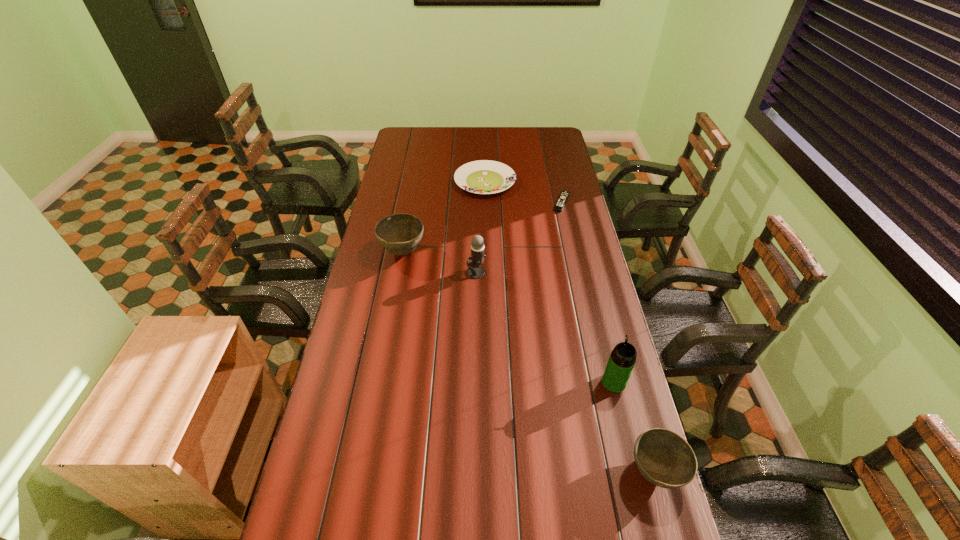
The height and width of the screenshot is (540, 960). Find the location of `free space located on the front of the salad plate`. free space located on the front of the salad plate is located at coordinates (486, 208).

Where is `vacant region located 0.170m on the front of the shortest object`? The height and width of the screenshot is (540, 960). vacant region located 0.170m on the front of the shortest object is located at coordinates (569, 238).

This screenshot has height=540, width=960. Identify the location of blank space located from the spout of the fifth farthest object. (604, 341).

The width and height of the screenshot is (960, 540). What are the coordinates of `free space located from the spout of the fifth farthest object` in the screenshot? It's located at (594, 302).

Find the location of a particular element. free space located from the spout of the fifth farthest object is located at coordinates (608, 356).

Locate an element on the screen. Image resolution: width=960 pixels, height=540 pixels. vacant space located on the front of the microphone is located at coordinates (475, 325).

You are a GUI agent. You are given a task and a screenshot of the screen. Output one action in this format:
    pyautogui.click(x=<x>, y=<y>)
    Task: Click on the object that is positioned at the near edge
    
    Given the screenshot: What is the action you would take?
    pyautogui.click(x=665, y=459)

The width and height of the screenshot is (960, 540). I want to click on object that is positioned at the left edge, so click(x=399, y=234).

The width and height of the screenshot is (960, 540). Identify the location of bowl that is at the right edge. (665, 459).

Where is `remote control at the right edge`? remote control at the right edge is located at coordinates (564, 195).